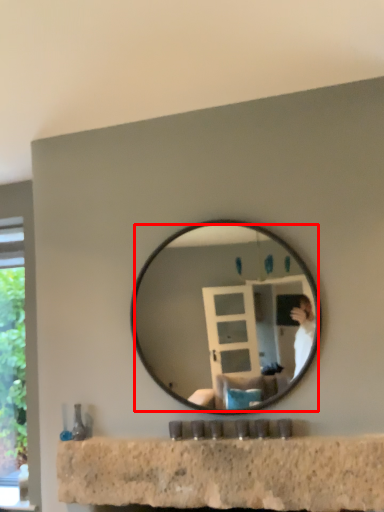
Question: Considering the relative positions of mirror (annotated by the red box) and counter top in the image provided, where is mirror (annotated by the red box) located with respect to the staircase?

Choices:
 (A) right
 (B) left

Answer: (A)